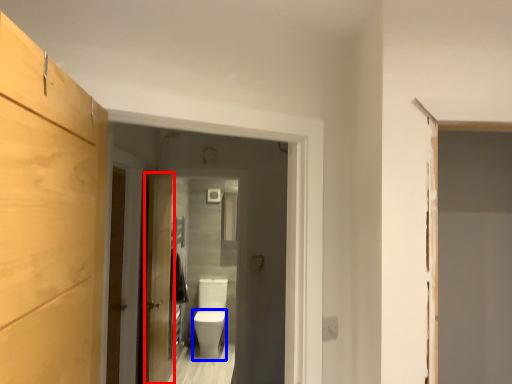
Question: Which object is closer to the camera taking this photo, door (highlighted by a red box) or toilet bowl (highlighted by a blue box)?

Choices:
 (A) door
 (B) toilet bowl

Answer: (A)